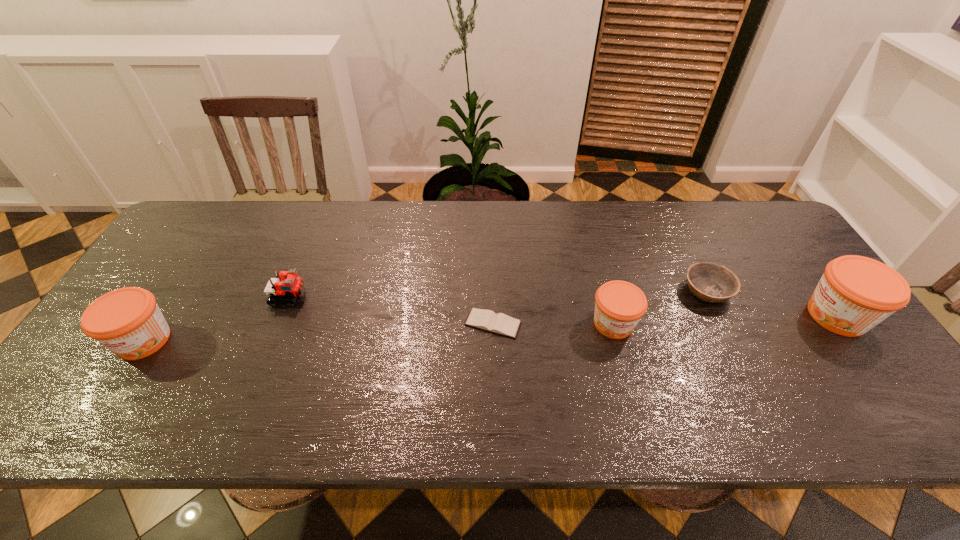
Where is `object that is at the right edge`? Image resolution: width=960 pixels, height=540 pixels. object that is at the right edge is located at coordinates (856, 293).

At what (x,y) coordinates should I click in order to perform the action: click on object that is positioned at the near left corner. Please return your answer as a coordinate pair (x, y). The image size is (960, 540). Looking at the image, I should click on (127, 321).

Locate an element on the screen. free space at the far edge is located at coordinates (636, 228).

Where is `blank area at the near edge`? This screenshot has width=960, height=540. blank area at the near edge is located at coordinates (202, 367).

This screenshot has width=960, height=540. What are the coordinates of `vacant space at the left edge` in the screenshot? It's located at (217, 251).

In the image, there is a desktop. Find the location of `vacant region at the far left corner`. vacant region at the far left corner is located at coordinates (198, 210).

Identify the location of vacant space that's between the fourth object from right to left and the rightmost jam. (665, 320).

Locate an element on the screen. free space between the Lego and the rightmost jam is located at coordinates (564, 306).

Locate an element on the screen. This screenshot has height=540, width=960. vacant space that's between the second shortest object and the third object from right to left is located at coordinates (660, 307).

Image resolution: width=960 pixels, height=540 pixels. I want to click on vacant area that lies between the shortest object and the second jam from left to right, so click(x=553, y=323).